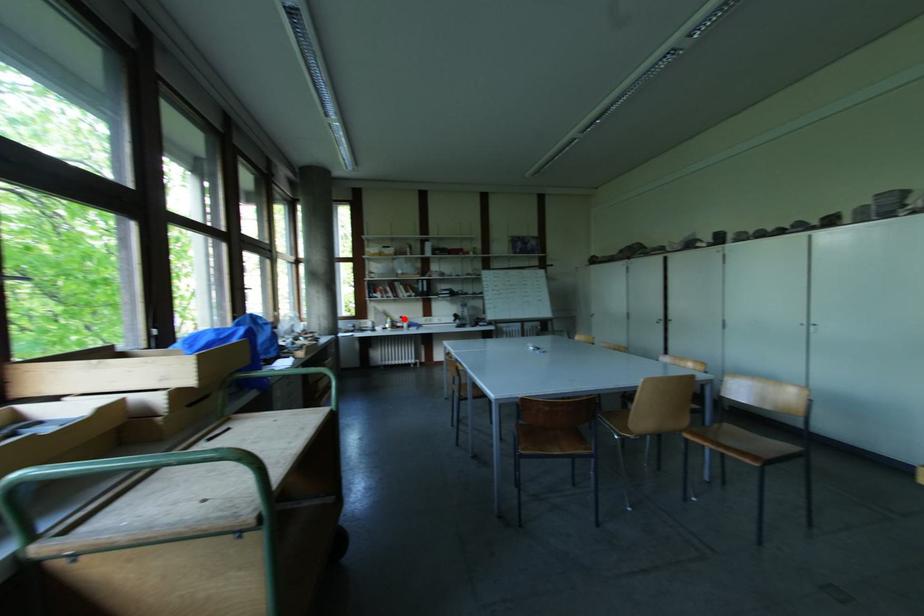
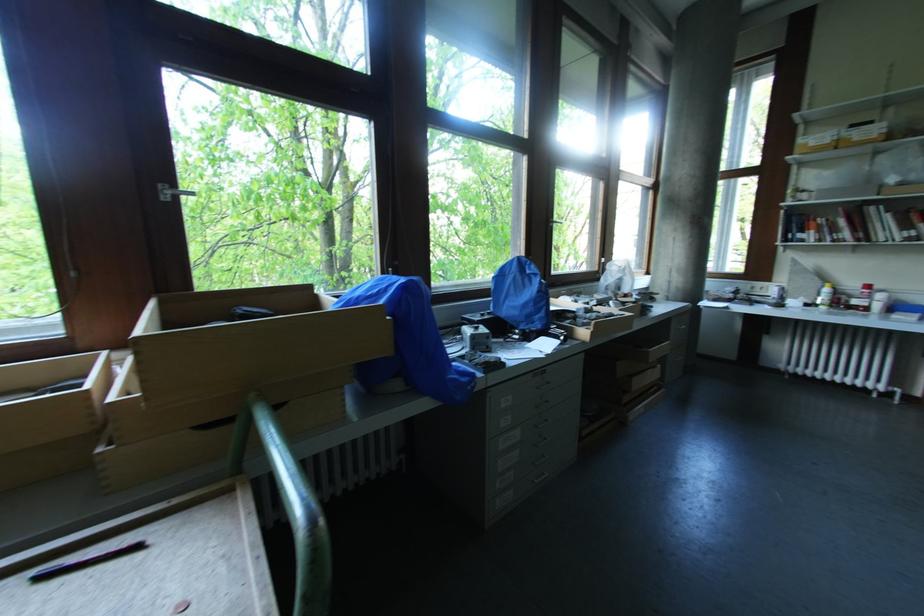
Find the pixel in the second image that matches the highlighted location in the first image.

(871, 288)